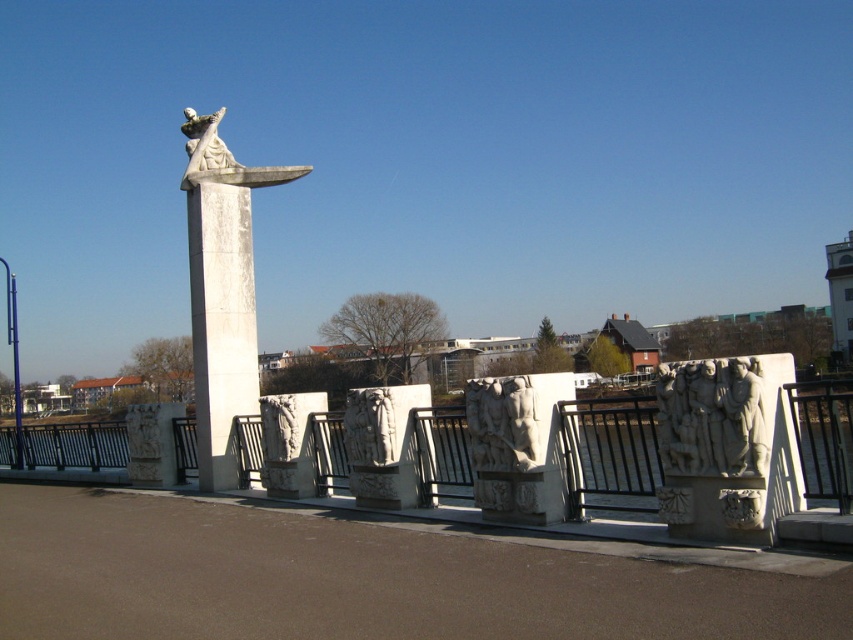
Question: Is white stone column at center smaller than white stone statue at upper center?

Choices:
 (A) yes
 (B) no

Answer: (A)

Question: Can you confirm if white stone column at center is bigger than white stone statue at upper center?

Choices:
 (A) yes
 (B) no

Answer: (B)

Question: Which object appears farthest from the camera in this image?

Choices:
 (A) white stone statue at upper center
 (B) white stone carving at right
 (C) white stone statue at center

Answer: (A)

Question: Is the position of white stone statue at center less distant than that of white stone carving at right?

Choices:
 (A) yes
 (B) no

Answer: (B)

Question: Estimate the real-world distances between objects in this image. Which object is closer to the white stone carving at right?

Choices:
 (A) white stone fence at center
 (B) white stone statue at upper center
 (C) white stone column at center

Answer: (A)

Question: Which object is farther from the camera taking this photo?

Choices:
 (A) white stone fence at center
 (B) white stone carving at right

Answer: (B)